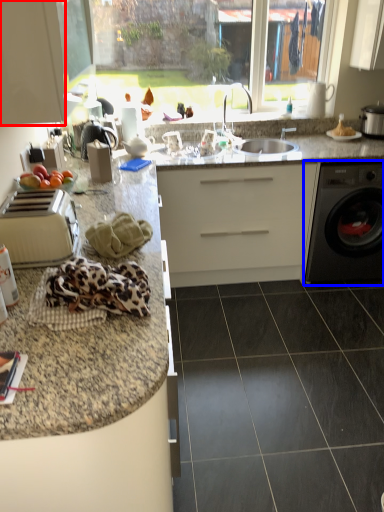
Question: Which point is closer to the camera, cabinetry (highlighted by a red box) or washing machine (highlighted by a blue box)?

Choices:
 (A) cabinetry
 (B) washing machine

Answer: (A)